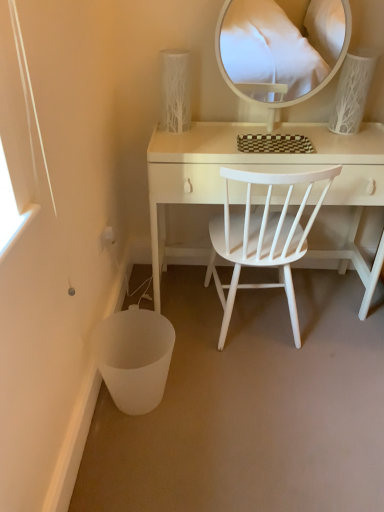
Where is `free location to the left of white textured vase at upper right, the second table lamp positioned from the left`? free location to the left of white textured vase at upper right, the second table lamp positioned from the left is located at coordinates (317, 132).